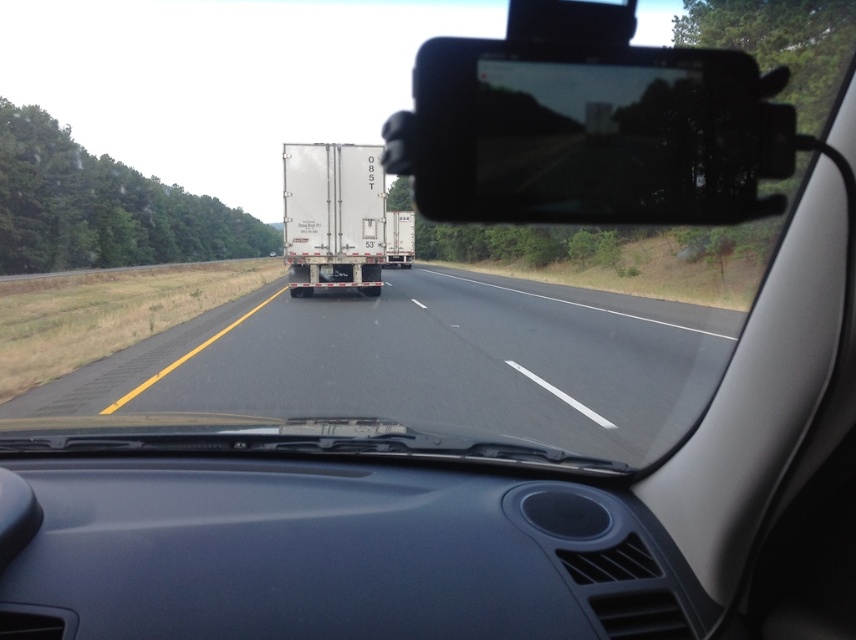
Describe the element at coordinates (428, 362) in the screenshot. I see `gray asphalt highway at center` at that location.

Does gray asphalt highway at center have a smaller size compared to white matte trailer at center?

No.

This screenshot has height=640, width=856. What do you see at coordinates (428, 362) in the screenshot? I see `gray asphalt highway at center` at bounding box center [428, 362].

At what (x,y) coordinates should I click in order to perform the action: click on gray asphalt highway at center. Please return your answer as a coordinate pair (x, y). This screenshot has height=640, width=856. Looking at the image, I should click on (428, 362).

Consider the image. Does matte black dashboard at center have a lesser height compared to white matte trailer at center?

Correct, matte black dashboard at center is not as tall as white matte trailer at center.

At what (x,y) coordinates should I click in order to perform the action: click on matte black dashboard at center. Please return your answer as a coordinate pair (x, y). Image resolution: width=856 pixels, height=640 pixels. Looking at the image, I should click on (343, 554).

Does point (383, 218) come farther from viewer compared to point (385, 262)?

No, (383, 218) is closer to viewer.

Is point (383, 244) less distant than point (397, 243)?

Yes.

What do you see at coordinates (333, 216) in the screenshot?
I see `white matte trailer truck at center` at bounding box center [333, 216].

Where is `white matte trailer truck at center`? white matte trailer truck at center is located at coordinates (333, 216).